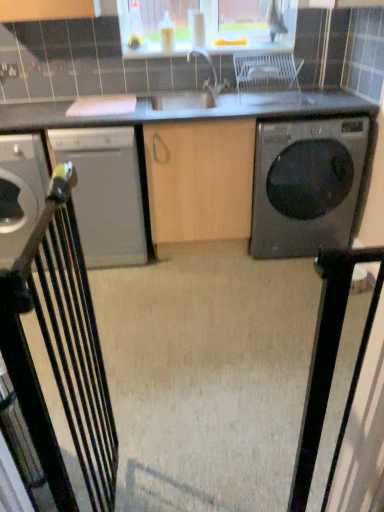
Question: Is satin white dishwasher at left, marked as the first home appliance in a right-to-left arrangement, facing away from black glossy washing machine at right?

Choices:
 (A) no
 (B) yes

Answer: (A)

Question: Can you confirm if satin white dishwasher at left, placed as the 2th home appliance when sorted from left to right, is positioned to the left of black glossy washing machine at right?

Choices:
 (A) no
 (B) yes

Answer: (B)

Question: Is satin white dishwasher at left, placed as the 2th home appliance when sorted from left to right, behind black glossy washing machine at right?

Choices:
 (A) yes
 (B) no

Answer: (A)

Question: Can you confirm if satin white dishwasher at left, placed as the 2th home appliance when sorted from left to right, is bigger than black glossy washing machine at right?

Choices:
 (A) no
 (B) yes

Answer: (A)

Question: From a real-world perspective, is satin white dishwasher at left, placed as the 2th home appliance when sorted from left to right, physically below black glossy washing machine at right?

Choices:
 (A) yes
 (B) no

Answer: (B)

Question: Considering their positions, is metallic gray dishwasher at left, which is the 1th home appliance from left to right, located in front of or behind white plastic chair at center, the first chair positioned from the right?

Choices:
 (A) behind
 (B) front

Answer: (A)

Question: Considering the positions of point (26, 193) and point (248, 90), is point (26, 193) closer or farther from the camera than point (248, 90)?

Choices:
 (A) farther
 (B) closer

Answer: (B)

Question: Is metallic gray dishwasher at left, which is the 2th home appliance from right to left, situated inside white plastic chair at center, which appears as the 1th chair when viewed from the top, or outside?

Choices:
 (A) outside
 (B) inside

Answer: (A)

Question: Is metallic gray dishwasher at left, which is the 1th home appliance from left to right, wider or thinner than white plastic chair at center, the 1th chair viewed from the back?

Choices:
 (A) thin
 (B) wide

Answer: (B)

Question: From a real-world perspective, is satin white dishwasher at left, marked as the first home appliance in a right-to-left arrangement, physically located above or below black glossy washing machine at right?

Choices:
 (A) below
 (B) above

Answer: (B)

Question: From the image's perspective, is satin white dishwasher at left, marked as the first home appliance in a right-to-left arrangement, positioned above or below black glossy washing machine at right?

Choices:
 (A) above
 (B) below

Answer: (B)

Question: In terms of width, does satin white dishwasher at left, placed as the 2th home appliance when sorted from left to right, look wider or thinner when compared to black glossy washing machine at right?

Choices:
 (A) wide
 (B) thin

Answer: (B)

Question: In the image, is satin white dishwasher at left, marked as the first home appliance in a right-to-left arrangement, positioned in front of or behind black glossy washing machine at right?

Choices:
 (A) behind
 (B) front

Answer: (A)

Question: Based on their sizes in the image, would you say white plastic chair at center, positioned as the second chair in front-to-back order, is bigger or smaller than metallic gray dishwasher at left, which is the 1th home appliance from left to right?

Choices:
 (A) big
 (B) small

Answer: (B)

Question: From the image's perspective, relative to metallic gray dishwasher at left, which is the 1th home appliance from left to right, is white plastic chair at center, which appears as the 1th chair when viewed from the top, above or below?

Choices:
 (A) below
 (B) above

Answer: (B)